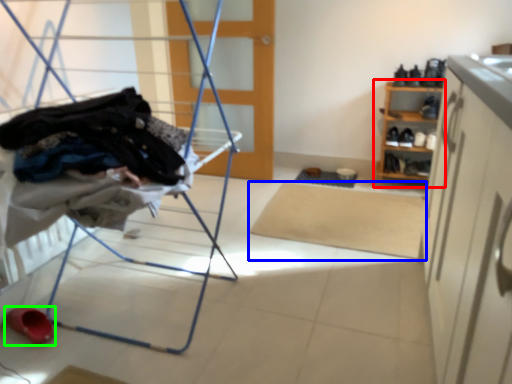
Question: Which object is the closest to the shelf (highlighted by a red box)? Choose among these: mat (highlighted by a blue box) or footwear (highlighted by a green box).

Choices:
 (A) mat
 (B) footwear

Answer: (A)